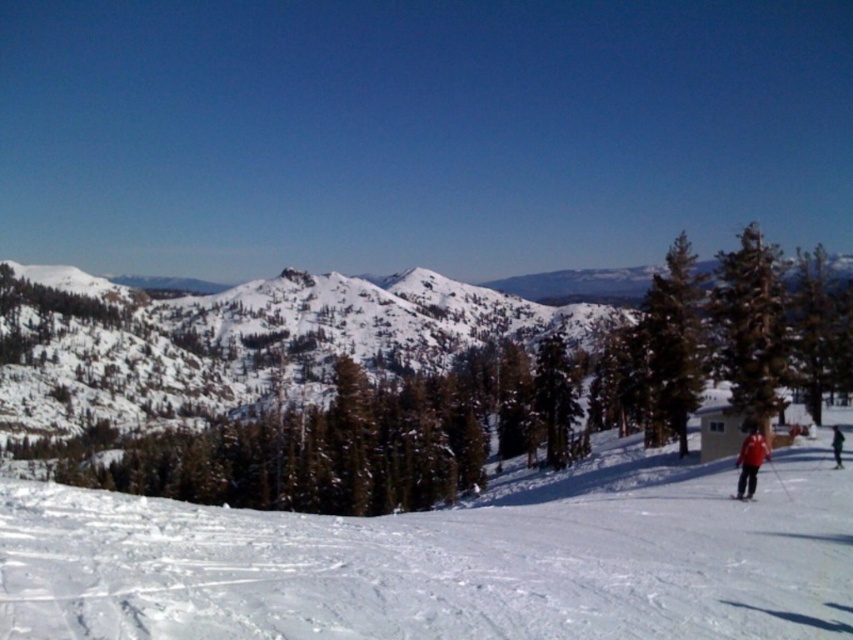
Who is more distant from viewer, (604, 376) or (704, 493)?

Positioned behind is point (604, 376).

Does green textured pine at center have a greater height compared to white powdery snow at lower center?

Indeed, green textured pine at center has a greater height compared to white powdery snow at lower center.

Image resolution: width=853 pixels, height=640 pixels. Identify the location of green textured pine at center. (399, 378).

The image size is (853, 640). I want to click on green textured pine at center, so click(x=399, y=378).

Can you confirm if red matte skier at lower right is bigger than black matte ski at lower right?

Yes, red matte skier at lower right is bigger than black matte ski at lower right.

Does red matte skier at lower right have a greater width compared to black matte ski at lower right?

Correct, the width of red matte skier at lower right exceeds that of black matte ski at lower right.

What do you see at coordinates (750, 461) in the screenshot? I see `red matte skier at lower right` at bounding box center [750, 461].

The width and height of the screenshot is (853, 640). Find the location of `red matte skier at lower right`. red matte skier at lower right is located at coordinates (750, 461).

Describe the element at coordinates (399, 378) in the screenshot. The width and height of the screenshot is (853, 640). I see `green textured pine at center` at that location.

Which is more to the left, green textured pine at center or black matte ski at lower right?

From the viewer's perspective, green textured pine at center appears more on the left side.

This screenshot has height=640, width=853. What are the coordinates of `green textured pine at center` in the screenshot? It's located at (399, 378).